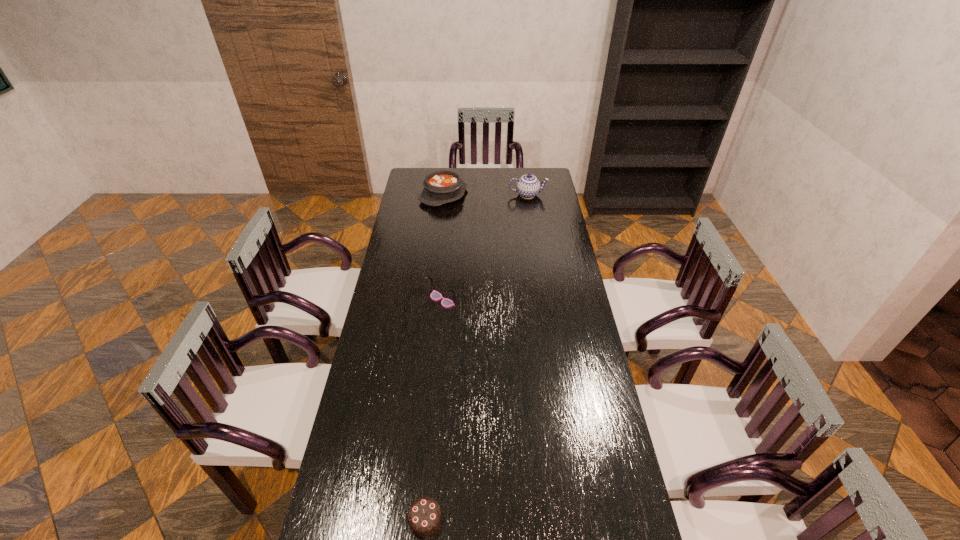
Find the location of a particular element. free point between the chinaware and the spectacles is located at coordinates (485, 247).

The height and width of the screenshot is (540, 960). Identify the location of free space between the shortest object and the rightmost object. (476, 357).

Identify the location of vacant point located between the rightmost object and the shortest object. The height and width of the screenshot is (540, 960). (476, 357).

Locate an element on the screen. The height and width of the screenshot is (540, 960). vacant space that is in between the casserole and the tallest object is located at coordinates tap(486, 195).

You are a GUI agent. You are given a task and a screenshot of the screen. Output one action in this format:
    pyautogui.click(x=<x>, y=<y>)
    Task: Click on the free point between the casserole and the spectacles
    The height and width of the screenshot is (540, 960).
    Given the screenshot: What is the action you would take?
    pyautogui.click(x=443, y=247)

Find the location of a particular element. vacant area that lies between the tallest object and the chocolate cake is located at coordinates [x=476, y=357].

The width and height of the screenshot is (960, 540). I want to click on unoccupied position between the casserole and the tallest object, so click(486, 195).

The width and height of the screenshot is (960, 540). Find the location of `free space that is in between the casserole and the tallest object`. free space that is in between the casserole and the tallest object is located at coordinates (486, 195).

The height and width of the screenshot is (540, 960). Identify the location of empty space that is in between the spectacles and the nearest object. (434, 409).

Locate an element on the screen. free area in between the third farthest object and the shortest object is located at coordinates tap(434, 409).